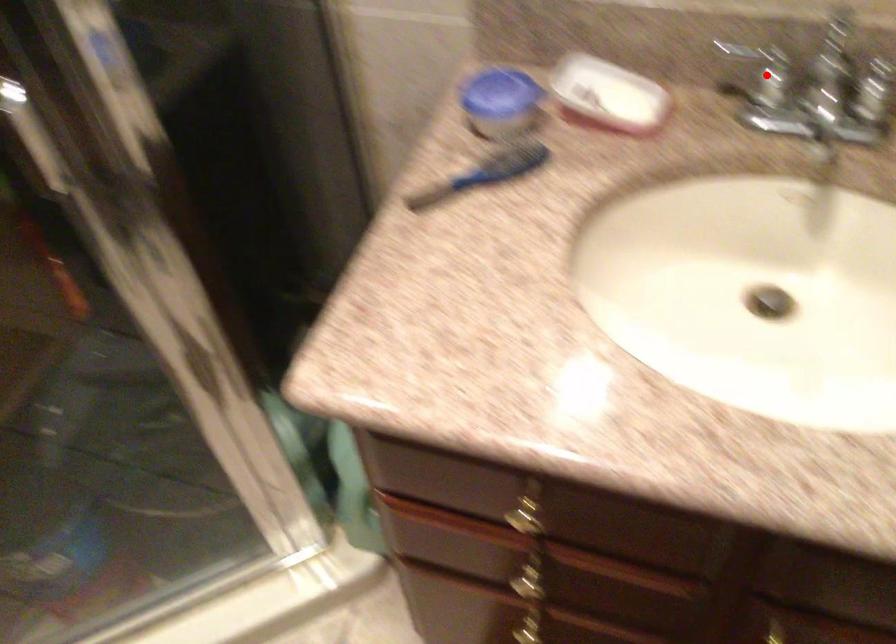
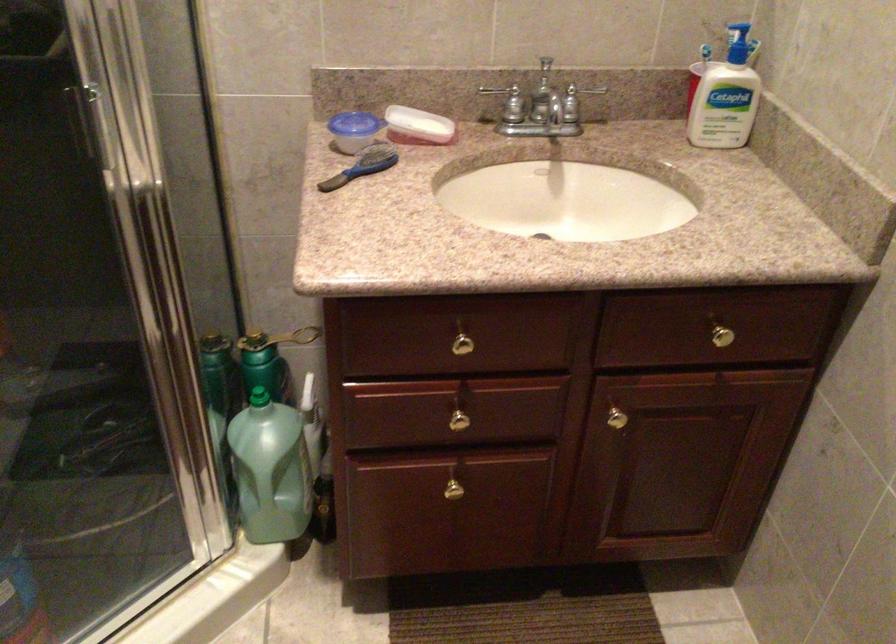
Where in the second image is the point corresponding to the highlighted location from the first image?

(509, 102)